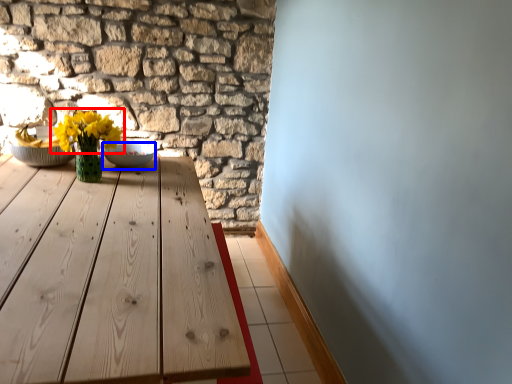
Question: Which object appears farthest to the camera in this image, flower (highlighted by a red box) or bowl (highlighted by a blue box)?

Choices:
 (A) flower
 (B) bowl

Answer: (B)